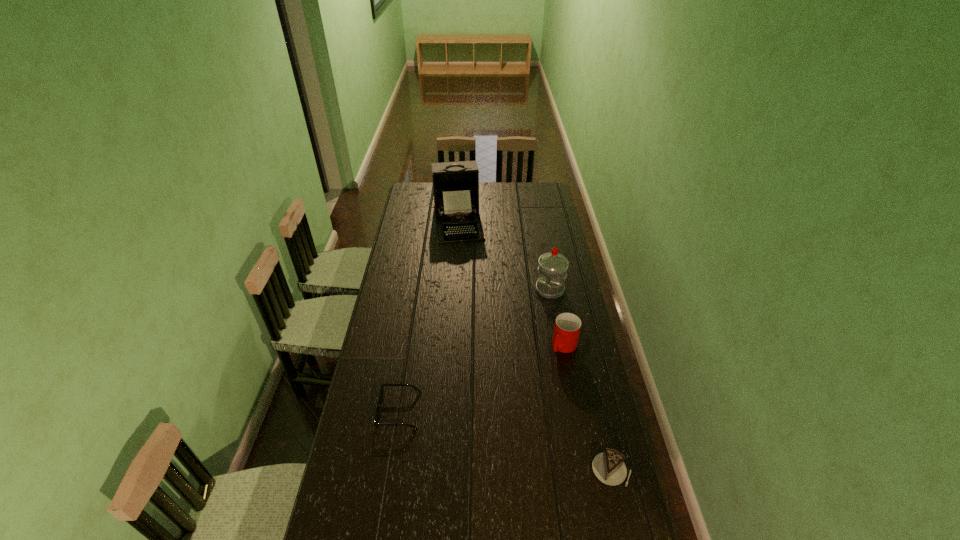
Find the location of `free space on the desktop that is between the shortest object and the nearest object and is positioned on the side of the third tallest object with the handle`. free space on the desktop that is between the shortest object and the nearest object and is positioned on the side of the third tallest object with the handle is located at coordinates (488, 435).

This screenshot has height=540, width=960. What are the coordinates of `vacant space on the desktop that is between the sunglasses and the chocolate cake and is positioned inside the open case of the farthest object` in the screenshot? It's located at (493, 437).

Image resolution: width=960 pixels, height=540 pixels. Identify the location of vacant space on the desktop that is between the fourth farthest object and the nearest object and is positioned on the handle side of the water bottle. (472, 431).